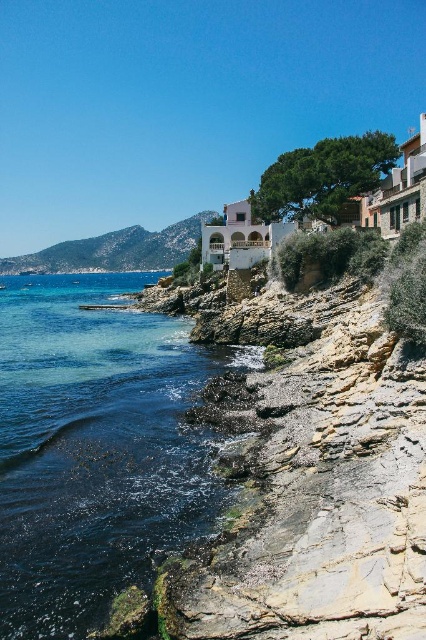
Does clear blue water at lower left appear on the left side of green grassy hillside at upper left?

In fact, clear blue water at lower left is to the right of green grassy hillside at upper left.

Does clear blue water at lower left have a greater height compared to green grassy hillside at upper left?

Incorrect, clear blue water at lower left's height is not larger of green grassy hillside at upper left's.

Does point (141, 554) lie behind point (149, 257)?

No.

Image resolution: width=426 pixels, height=640 pixels. In order to click on clear blue water at lower left in this screenshot , I will do `click(95, 449)`.